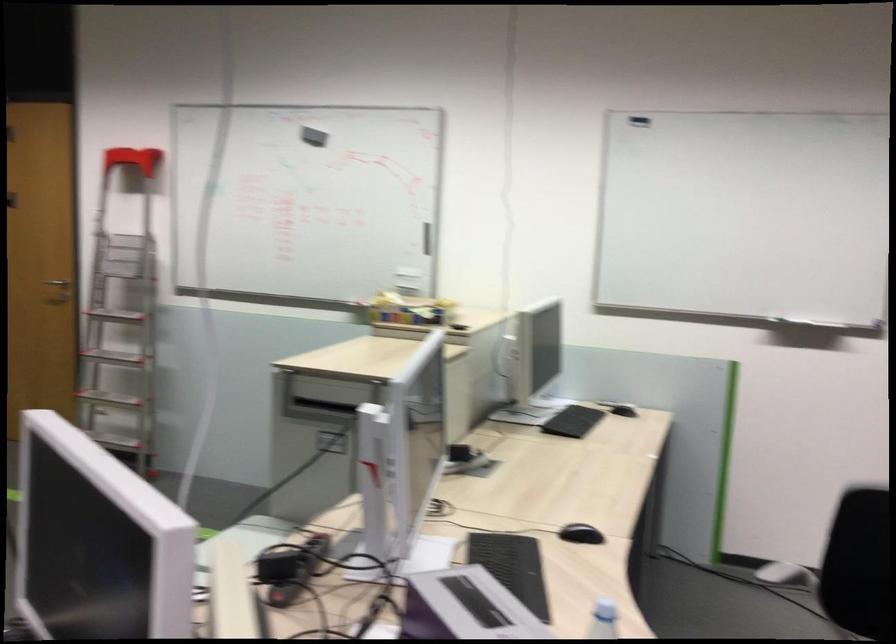
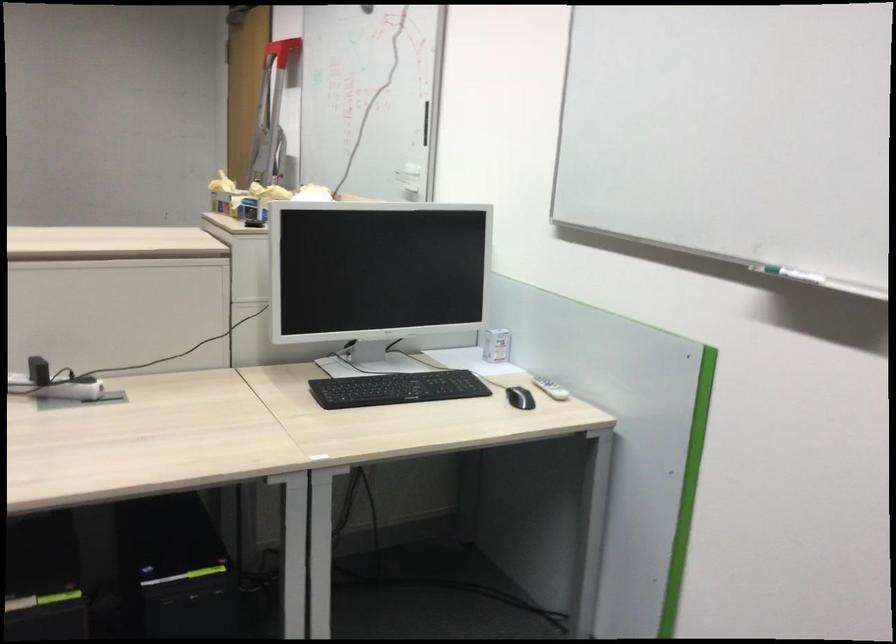
Where in the second image is the point corresponding to pixel 645 406 from the first image?

(520, 398)